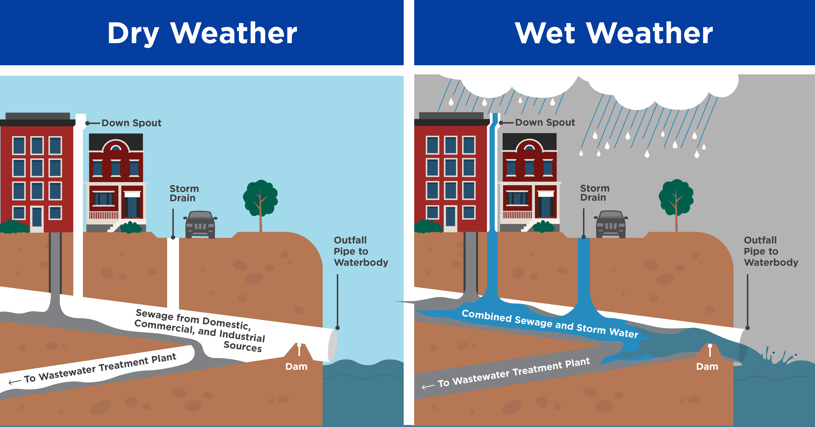
Locate an element on the screen. This screenshot has width=815, height=427. stairs is located at coordinates (112, 227), (527, 226).